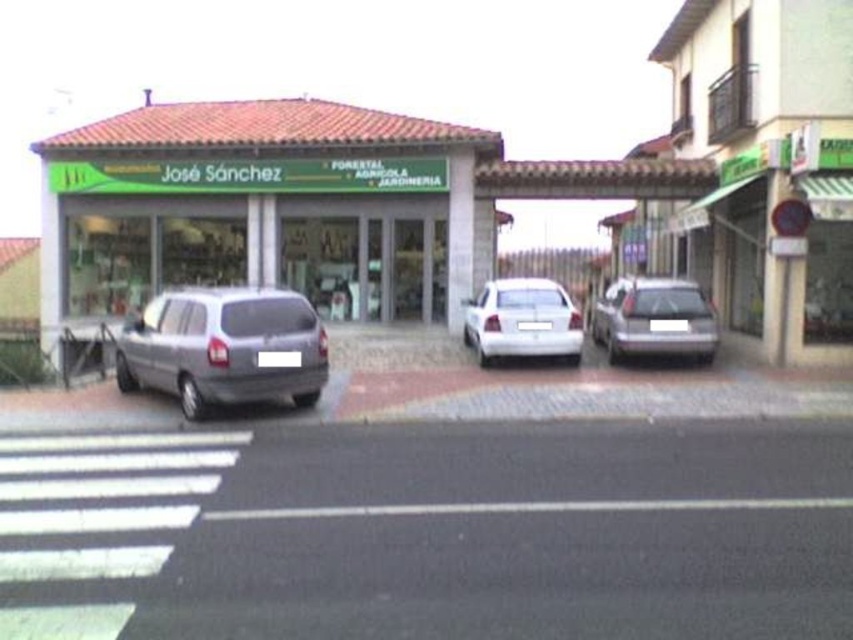
Question: Does black asphalt road at lower center have a greater width compared to white glossy sedan at center?

Choices:
 (A) yes
 (B) no

Answer: (B)

Question: Is black asphalt road at lower center positioned at the back of white glossy sedan at center?

Choices:
 (A) no
 (B) yes

Answer: (A)

Question: Which point is closer to the camera?

Choices:
 (A) white glossy sedan at center
 (B) black asphalt road at lower center

Answer: (B)

Question: Which object is the farthest from the satin silver van at center?

Choices:
 (A) white glossy sedan at center
 (B) satin silver sedan at center
 (C) green matte storefront at center
 (D) black asphalt road at lower center

Answer: (C)

Question: Can you confirm if green matte storefront at center is wider than satin silver sedan at center?

Choices:
 (A) no
 (B) yes

Answer: (B)

Question: Estimate the real-world distances between objects in this image. Which object is farther from the black asphalt road at lower center?

Choices:
 (A) satin silver sedan at center
 (B) white glossy sedan at center

Answer: (B)